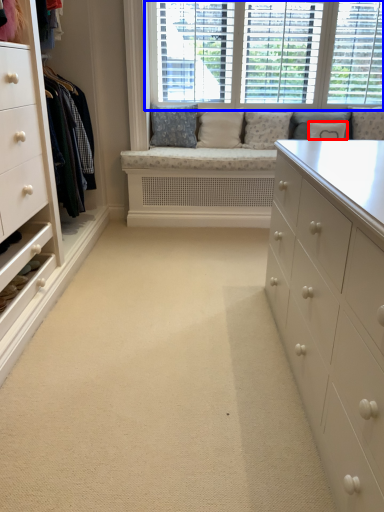
Question: Which object appears closest to the camera in this image, pillow (highlighted by a red box) or window (highlighted by a blue box)?

Choices:
 (A) pillow
 (B) window

Answer: (B)